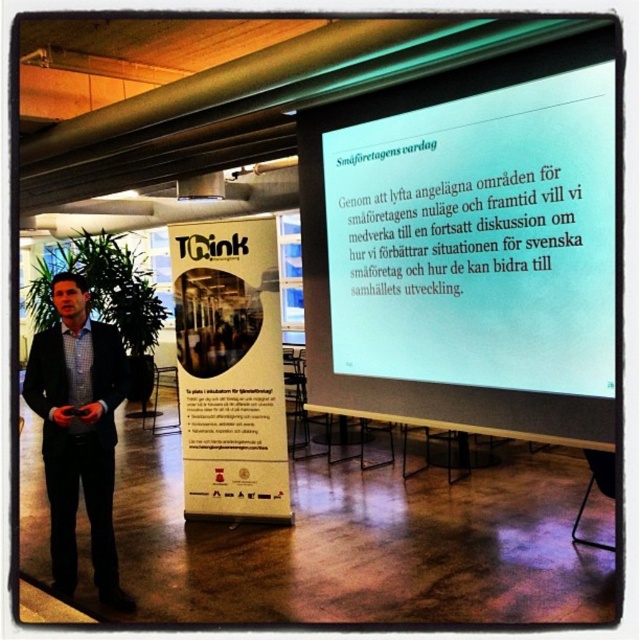
You are an attendee in the conference room and want to read the text on the white cardboard poster at center. However, the white matte projection screen at upper center is blocking your view. Can you move around to see the poster?

The white matte projection screen at upper center is in front of the white cardboard poster at center, so you cannot see the poster behind it without moving around the obstruction. However, since both are white, distinguishing them might be challenging. If you move to the side, you might get a better angle to see the poster behind the screen.